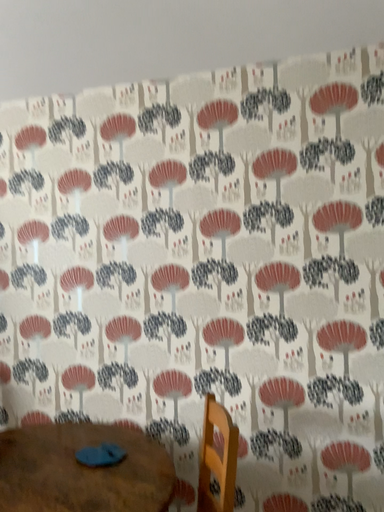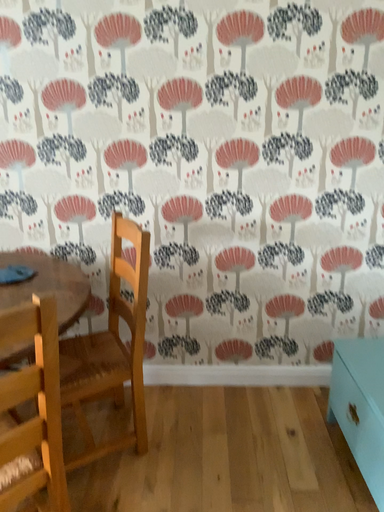
Question: How did the camera likely rotate when shooting the video?

Choices:
 (A) rotated upward
 (B) rotated downward

Answer: (B)